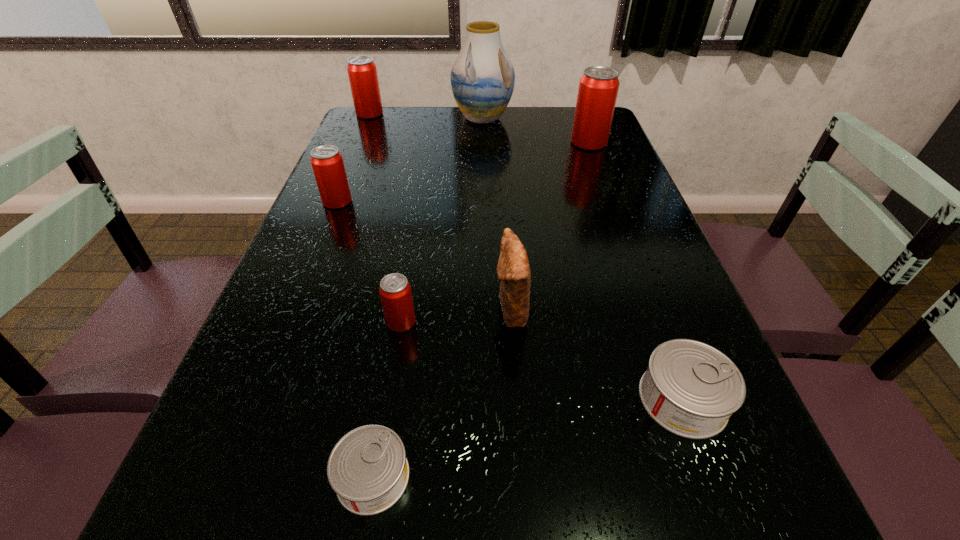
The image size is (960, 540). In order to click on free area in between the shortest object and the vase in this screenshot , I will do 428,298.

Select which object appears as the fifth closest to the clutch bag. Please provide its 2D coordinates. Your answer should be formatted as a tuple, i.e. [(x, y)], where the tuple contains the x and y coordinates of a point satisfying the conditions above.

[(598, 87)]

I want to click on object that is the seventh closest to the second tallest object, so click(368, 470).

Where is `can that is the fourth closest to the third shortest can`? can that is the fourth closest to the third shortest can is located at coordinates (598, 87).

Identify which can is located as the fifth nearest to the fifth shortest can. Please provide its 2D coordinates. Your answer should be formatted as a tuple, i.e. [(x, y)], where the tuple contains the x and y coordinates of a point satisfying the conditions above.

[(691, 389)]

Locate which red can is the second closest to the tallest object. Please provide its 2D coordinates. Your answer should be formatted as a tuple, i.e. [(x, y)], where the tuple contains the x and y coordinates of a point satisfying the conditions above.

[(362, 72)]

At what (x,y) coordinates should I click in order to perform the action: click on red can object that ranks as the third closest to the farthest red can. Please return your answer as a coordinate pair (x, y). This screenshot has width=960, height=540. Looking at the image, I should click on (395, 292).

The image size is (960, 540). What are the coordinates of `vacant position in the image that satisfies the following two spatial constraints: 1. on the front side of the left silver can; 2. on the left side of the fifth nearest object` in the screenshot? It's located at (226, 477).

The image size is (960, 540). I want to click on blank space that satisfies the following two spatial constraints: 1. on the back side of the vase; 2. on the right side of the sixth tallest object, so click(435, 118).

The height and width of the screenshot is (540, 960). I want to click on free space that satisfies the following two spatial constraints: 1. on the open side of the bigger silver can; 2. on the left side of the clutch bag, so click(517, 399).